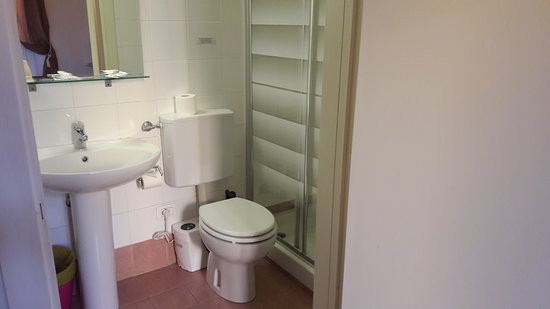
At what (x,y) coordinates should I click in order to perform the action: click on toilet seat. Please return your answer as a coordinate pair (x, y). This screenshot has width=550, height=309. Looking at the image, I should click on (240, 215).